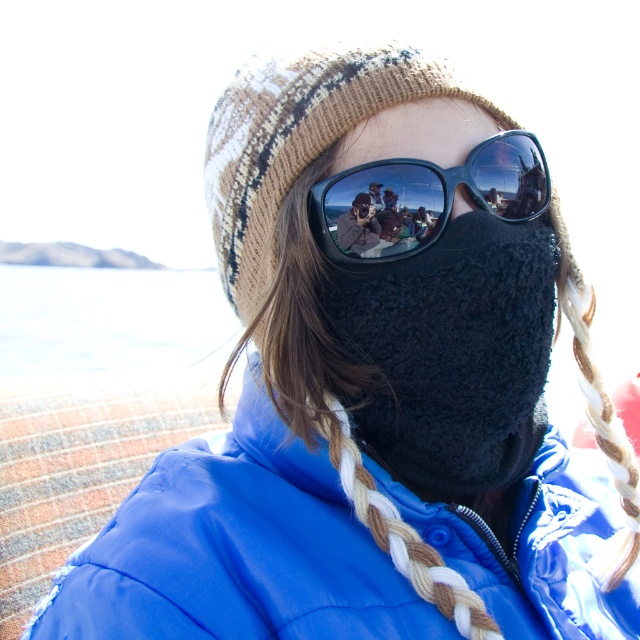
Question: Among these points, which one is farthest from the camera?

Choices:
 (A) (360, 193)
 (B) (28, 288)
 (C) (550, 483)
 (D) (544, 196)

Answer: (B)

Question: Does black glossy sunglasses at center have a greater width compared to black fuzzy mask at center?

Choices:
 (A) no
 (B) yes

Answer: (B)

Question: Which object appears closest to the camera in this image?

Choices:
 (A) black glossy sunglasses at center
 (B) blue puffy jacket at center
 (C) black fuzzy mask at center
 (D) white water at left

Answer: (B)

Question: Is blue puffy jacket at center to the right of black fuzzy mask at center from the viewer's perspective?

Choices:
 (A) no
 (B) yes

Answer: (B)

Question: Which point is closer to the camera?

Choices:
 (A) click(x=362, y=204)
 (B) click(x=380, y=248)
 (C) click(x=483, y=524)
 (D) click(x=28, y=268)

Answer: (B)

Question: Can you confirm if blue puffy jacket at center is smaller than black glossy sunglasses at center?

Choices:
 (A) no
 (B) yes

Answer: (A)